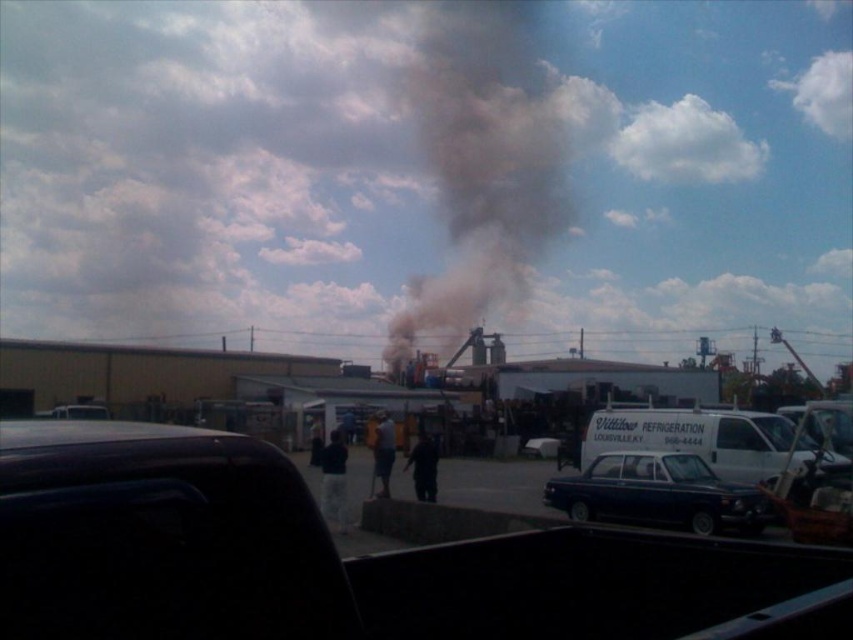
Question: Which object is the closest to the white fluffy cloud at upper center?

Choices:
 (A) white fluffy cloud at upper right
 (B) dark gray smoke at center
 (C) black smoke at center
 (D) shiny blue sedan at center

Answer: (A)

Question: Considering the real-world distances, which object is farthest from the dark gray smoke at center?

Choices:
 (A) shiny black sedan at center
 (B) shiny blue sedan at center
 (C) white fluffy cloud at upper center
 (D) black smoke at center

Answer: (B)

Question: In this image, where is white fluffy cloud at upper center located relative to white fluffy cloud at upper right?

Choices:
 (A) left
 (B) right

Answer: (A)

Question: Can you confirm if white fluffy cloud at upper center is positioned below white fluffy cloud at upper right?

Choices:
 (A) no
 (B) yes

Answer: (B)

Question: Which point is farther to the camera?

Choices:
 (A) (724, 154)
 (B) (531, 452)
 (C) (627, 516)

Answer: (A)

Question: Is white fluffy cloud at upper center to the left of white fluffy cloud at upper right from the viewer's perspective?

Choices:
 (A) yes
 (B) no

Answer: (A)